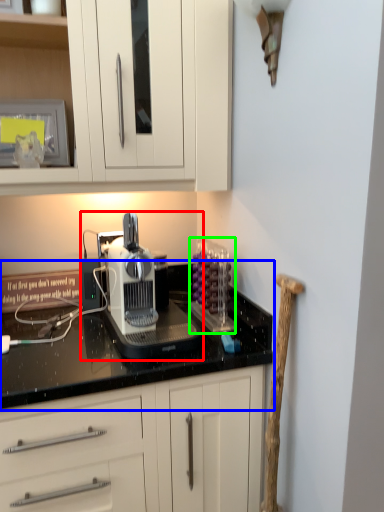
Question: Which object is positioned farthest from home appliance (highlighted by a red box)? Select from countertop (highlighted by a blue box) and kitchen appliance (highlighted by a green box).

Choices:
 (A) countertop
 (B) kitchen appliance

Answer: (B)